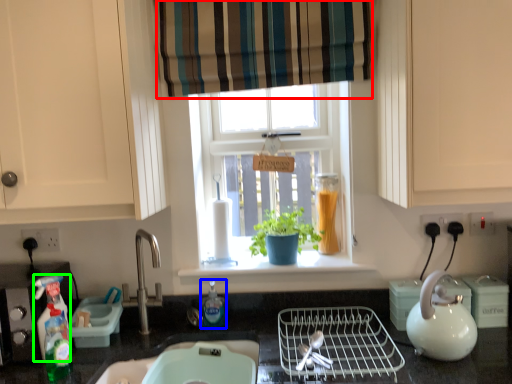
Question: Based on their relative distances, which object is farther from curtain (highlighted by a red box)? Choose from bottle (highlighted by a blue box) and cleaning product (highlighted by a green box).

Choices:
 (A) bottle
 (B) cleaning product

Answer: (B)